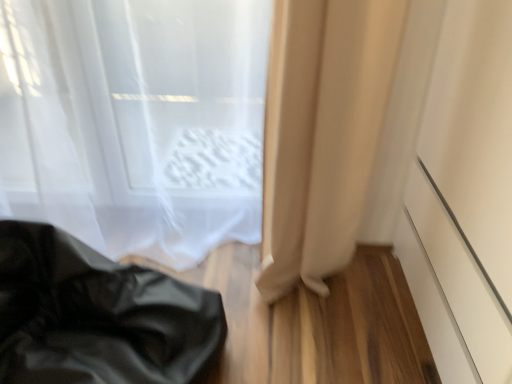
Question: Is black leather bag at lower left taller than beige fabric curtain at lower right, which is counted as the second curtain, starting from the left?

Choices:
 (A) no
 (B) yes

Answer: (A)

Question: From the image's perspective, is black leather bag at lower left on top of beige fabric curtain at lower right, positioned as the 1th curtain in right-to-left order?

Choices:
 (A) no
 (B) yes

Answer: (A)

Question: Does black leather bag at lower left come in front of beige fabric curtain at lower right, positioned as the 1th curtain in right-to-left order?

Choices:
 (A) no
 (B) yes

Answer: (B)

Question: Is black leather bag at lower left looking in the opposite direction of beige fabric curtain at lower right, positioned as the 1th curtain in right-to-left order?

Choices:
 (A) no
 (B) yes

Answer: (A)

Question: Does black leather bag at lower left have a greater width compared to beige fabric curtain at lower right, which is counted as the second curtain, starting from the left?

Choices:
 (A) yes
 (B) no

Answer: (A)

Question: Is beige fabric curtain at lower right, which is counted as the second curtain, starting from the left, completely or partially inside black leather bag at lower left?

Choices:
 (A) no
 (B) yes

Answer: (A)

Question: Is black leather bag at lower left shorter than translucent fabric curtain at upper left, which is counted as the 2th curtain, starting from the right?

Choices:
 (A) no
 (B) yes

Answer: (B)

Question: Are black leather bag at lower left and translucent fabric curtain at upper left, the 1th curtain positioned from the left, beside each other?

Choices:
 (A) no
 (B) yes

Answer: (A)

Question: From the image's perspective, is black leather bag at lower left located beneath translucent fabric curtain at upper left, the 1th curtain positioned from the left?

Choices:
 (A) no
 (B) yes

Answer: (B)

Question: Is black leather bag at lower left outside of translucent fabric curtain at upper left, which is counted as the 2th curtain, starting from the right?

Choices:
 (A) yes
 (B) no

Answer: (A)

Question: Would you say black leather bag at lower left is a long distance from translucent fabric curtain at upper left, which is counted as the 2th curtain, starting from the right?

Choices:
 (A) yes
 (B) no

Answer: (B)

Question: Could you tell me if black leather bag at lower left is turned towards translucent fabric curtain at upper left, the 1th curtain positioned from the left?

Choices:
 (A) no
 (B) yes

Answer: (A)

Question: From a real-world perspective, is white matte screen door at right located beneath translucent fabric curtain at upper left, which is counted as the 2th curtain, starting from the right?

Choices:
 (A) no
 (B) yes

Answer: (A)